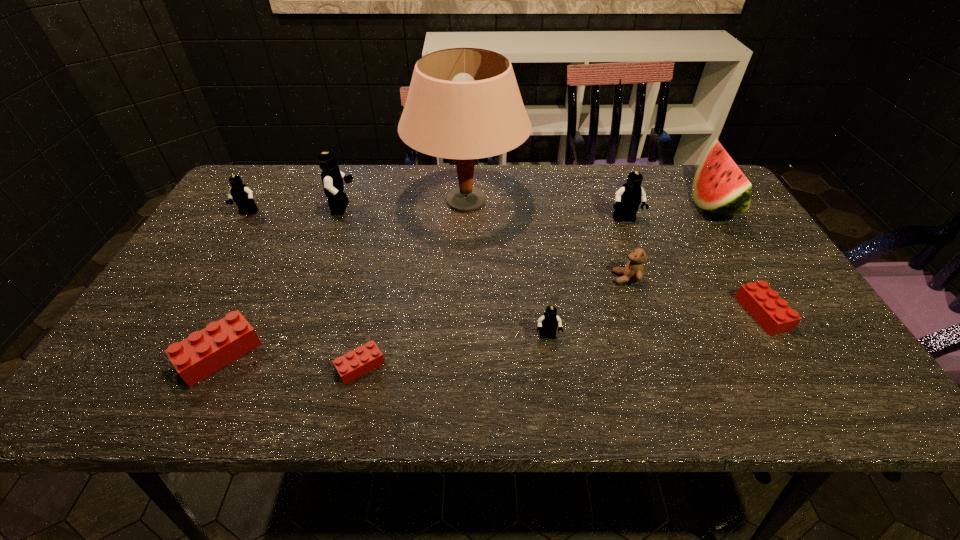
Locate an element on the screen. the tallest object is located at coordinates 463,103.

Locate an element on the screen. This screenshot has width=960, height=540. lampshade is located at coordinates (463, 103).

Identify the location of the biggest black Lego. (332, 178).

Locate an element on the screen. the eighth object from right to left is located at coordinates (332, 178).

The height and width of the screenshot is (540, 960). Find the location of `watermelon`. watermelon is located at coordinates (719, 186).

I want to click on the sixth Lego from left to right, so click(628, 198).

The height and width of the screenshot is (540, 960). I want to click on the rightmost black Lego, so 628,198.

What are the coordinates of `the leftmost black Lego` in the screenshot? It's located at (x=240, y=193).

The height and width of the screenshot is (540, 960). Identify the location of the third biggest black Lego. (240, 193).

Where is `teddy bear`? The image size is (960, 540). teddy bear is located at coordinates (633, 271).